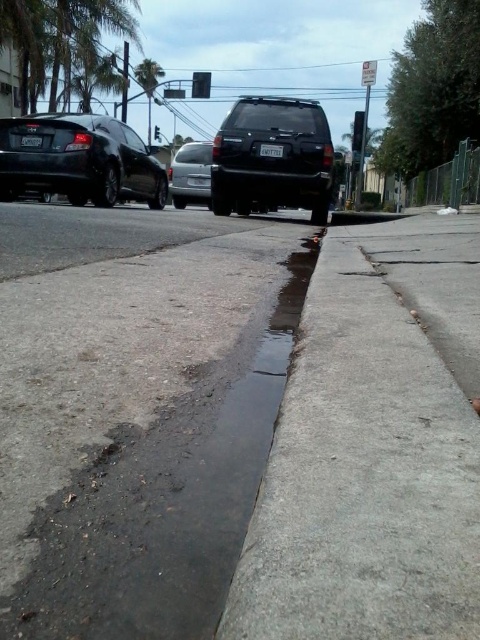
Question: Does satin silver sedan at center appear on the right side of metallic traffic light at upper center?

Choices:
 (A) no
 (B) yes

Answer: (B)

Question: Which of the following is the farthest from the observer?

Choices:
 (A) (278, 109)
 (B) (192, 148)

Answer: (B)

Question: Which object is the farthest from the black plastic traffic light at upper center?

Choices:
 (A) dull concrete sidewalk at center
 (B) metallic traffic light at upper center
 (C) gray concrete curb at lower center
 (D) satin silver sedan at center

Answer: (C)

Question: Among these objects, which one is nearest to the camera?

Choices:
 (A) glossy black sedan at left
 (B) dull concrete sidewalk at center

Answer: (B)

Question: Is gray concrete curb at lower center wider than black plastic traffic light at upper center?

Choices:
 (A) yes
 (B) no

Answer: (B)

Question: Is black glass traffic light at upper center to the left of metallic traffic light at upper center from the viewer's perspective?

Choices:
 (A) yes
 (B) no

Answer: (B)